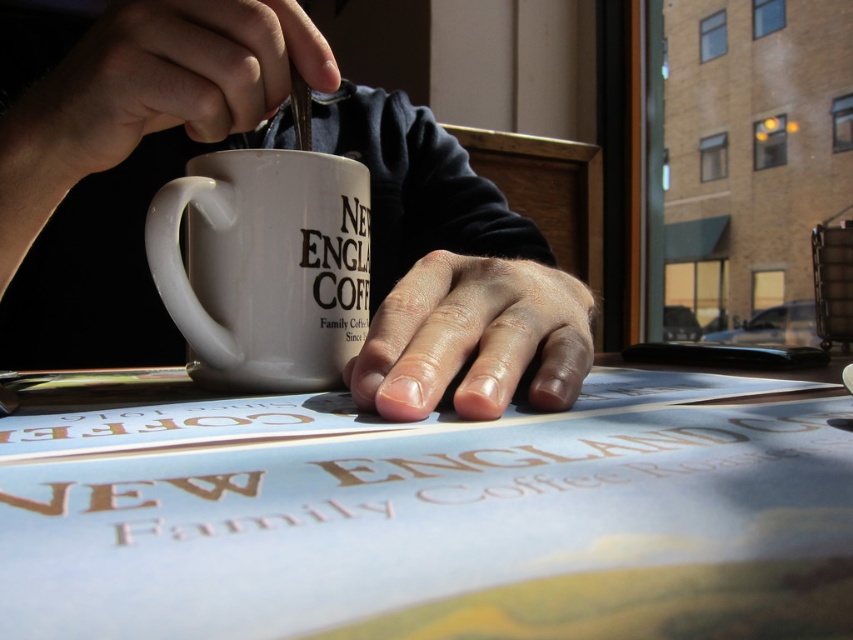
Question: Does smooth skin hand at upper left appear on the right side of dry skin at center?

Choices:
 (A) yes
 (B) no

Answer: (B)

Question: Can you confirm if white matte mug at center is bigger than dry skin at center?

Choices:
 (A) yes
 (B) no

Answer: (A)

Question: In this image, where is white matte mug at center located relative to dry skin at center?

Choices:
 (A) above
 (B) below

Answer: (A)

Question: Which point is closer to the camera taking this photo?

Choices:
 (A) (213, 269)
 (B) (59, 589)
 (C) (146, 122)
 (D) (538, 282)

Answer: (B)

Question: Which of the following is the farthest from the observer?

Choices:
 (A) dry skin at center
 (B) smooth skin hand at upper left
 (C) white paper at center

Answer: (B)

Question: Estimate the real-world distances between objects in this image. Which object is farther from the smooth skin hand at upper left?

Choices:
 (A) white paper at center
 (B) white ceramic mug at center
 (C) white matte mug at center

Answer: (A)